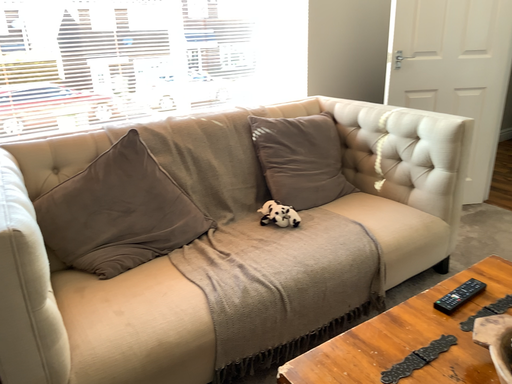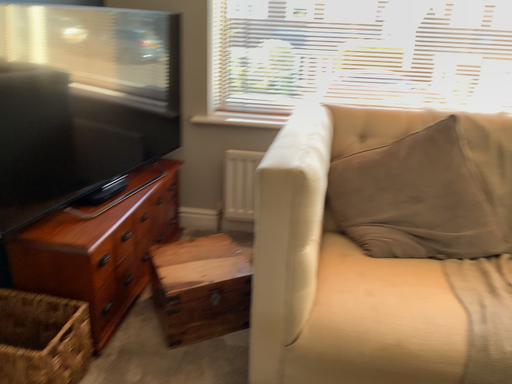
Question: Which way did the camera rotate in the video?

Choices:
 (A) rotated right
 (B) rotated left

Answer: (B)